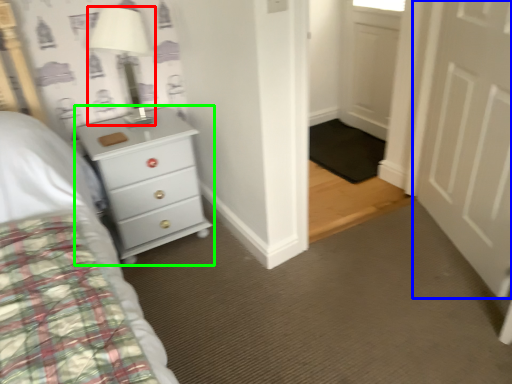
Question: Which object is positioned closest to lamp (highlighted by a red box)? Select from door (highlighted by a blue box) and chest of drawers (highlighted by a green box).

Choices:
 (A) door
 (B) chest of drawers

Answer: (B)